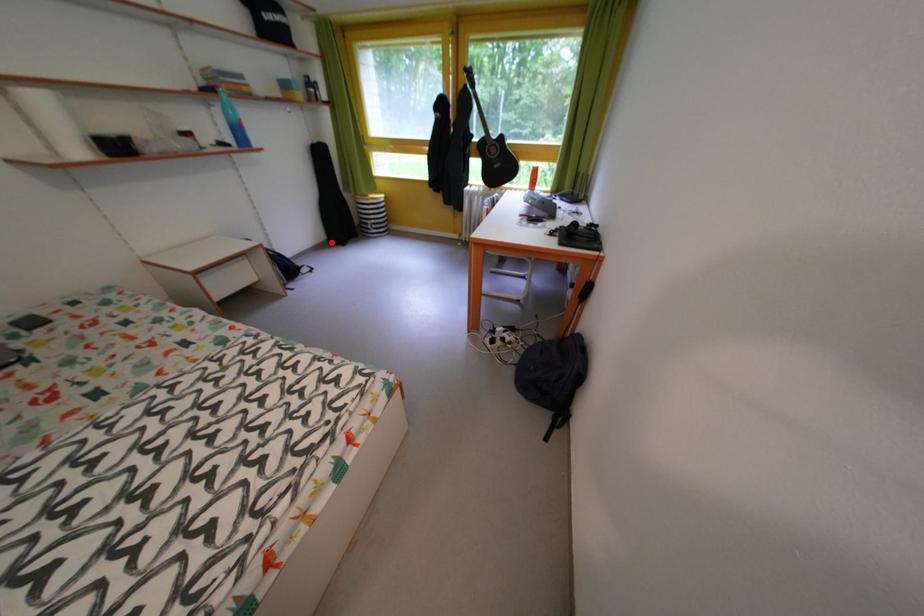
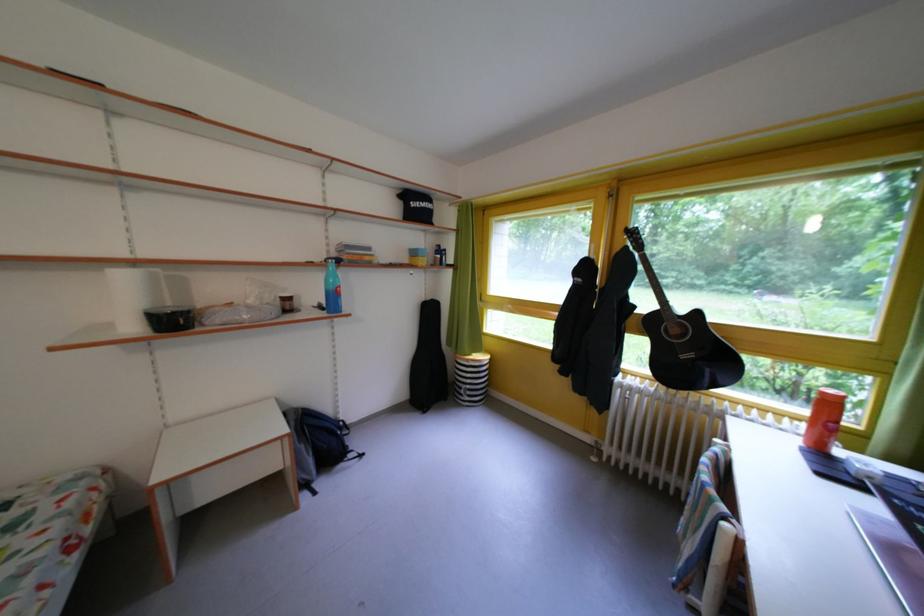
In the second image, find the point that corresponds to the highlighted location in the first image.

(415, 400)